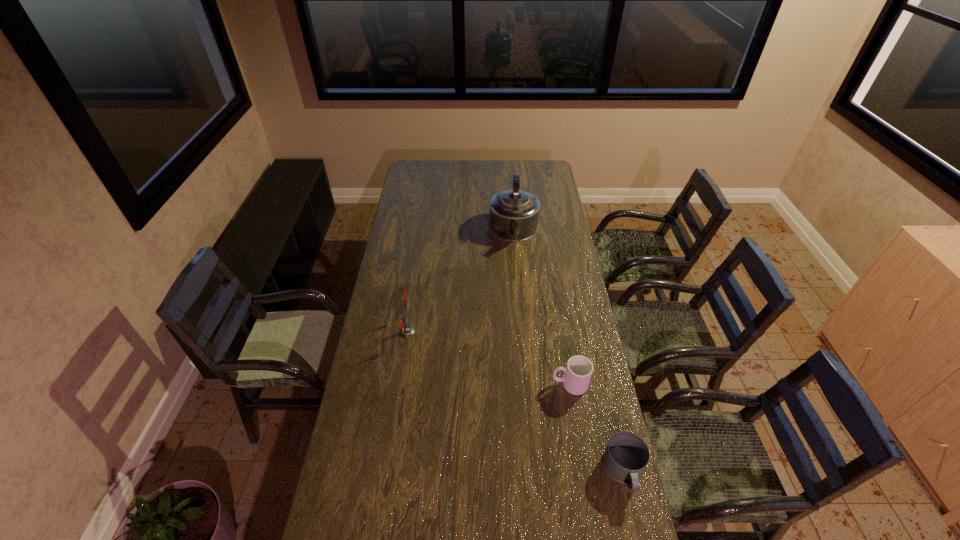
Locate an element on the screen. This screenshot has width=960, height=540. free spot on the desktop that is between the third shortest object and the mug and is positioned with the spout at the front of the farthest object is located at coordinates (516, 402).

You are a GUI agent. You are given a task and a screenshot of the screen. Output one action in this format:
    pyautogui.click(x=<x>, y=<y>)
    Task: Click on the vacant space on the desktop that is between the leftmost object and the mug and is positioned with the handle on the side of the third farthest object
    The height and width of the screenshot is (540, 960).
    Given the screenshot: What is the action you would take?
    pyautogui.click(x=480, y=379)